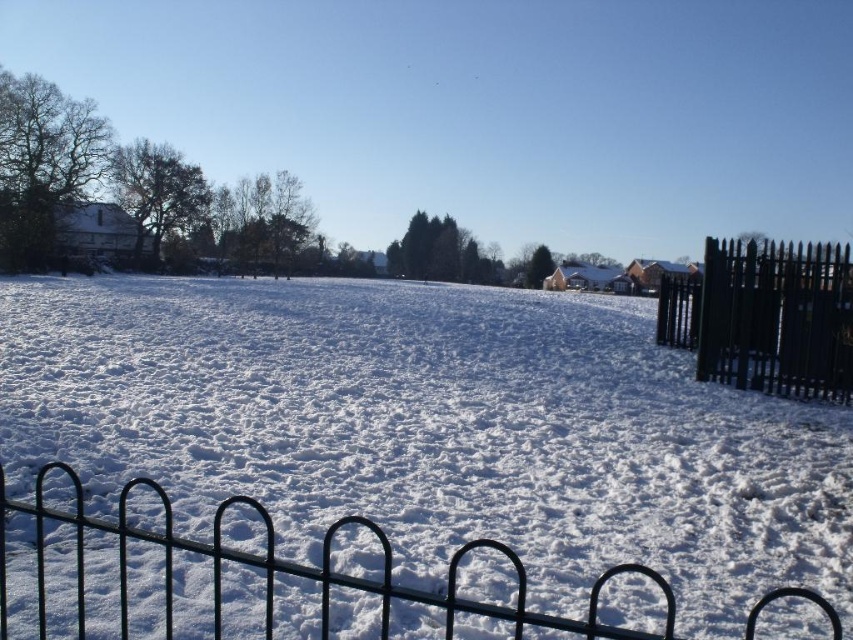
Question: Which object appears farthest from the camera in this image?

Choices:
 (A) white fluffy snow at center
 (B) black metal fence at right

Answer: (B)

Question: Does white fluffy snow at center appear on the left side of black metal fence at lower center?

Choices:
 (A) yes
 (B) no

Answer: (A)

Question: Can you confirm if white fluffy snow at center is positioned below black metal fence at lower center?

Choices:
 (A) no
 (B) yes

Answer: (A)

Question: Which of the following is the farthest from the observer?

Choices:
 (A) (723, 282)
 (B) (171, 285)
 (C) (0, 616)

Answer: (B)

Question: In this image, where is white fluffy snow at center located relative to black metal fence at lower center?

Choices:
 (A) below
 (B) above

Answer: (B)

Question: Which is farther from the white fluffy snow at center?

Choices:
 (A) black metal fence at right
 (B) black metal fence at lower center

Answer: (A)